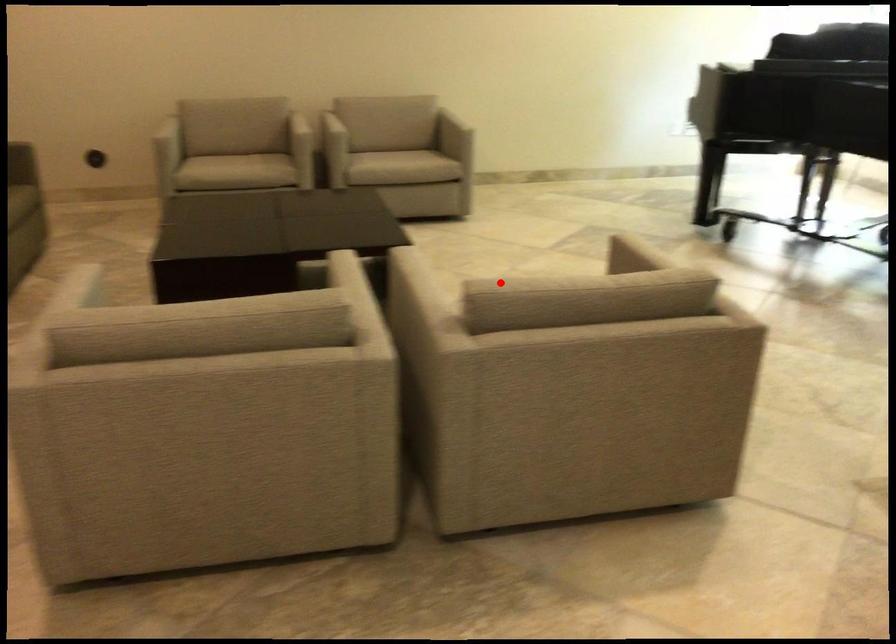
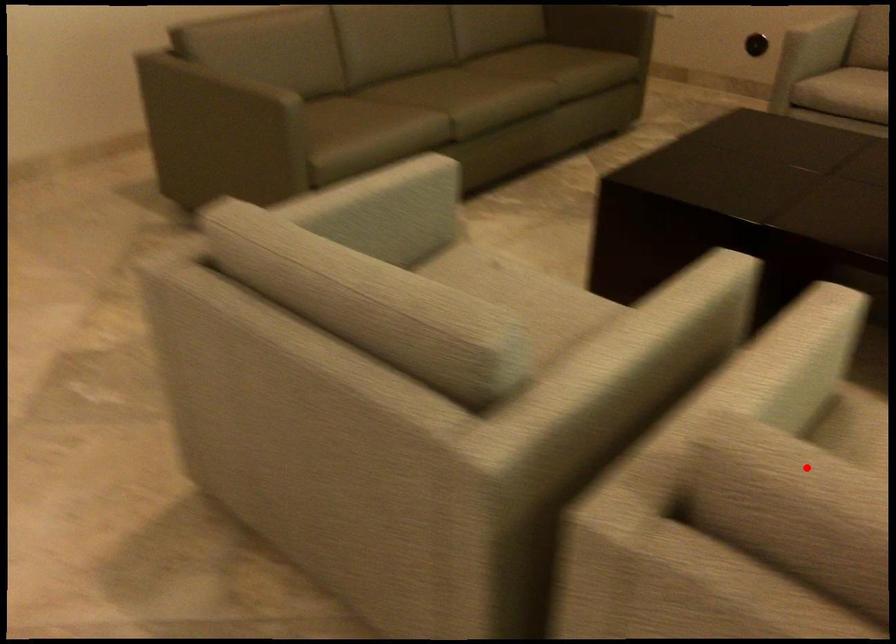
I am providing you with two images of the same scene from different viewpoints. A red point is marked on the first image and another point is marked on the second image. Does the point marked in image1 correspond to the same location as the one in image2?

Yes